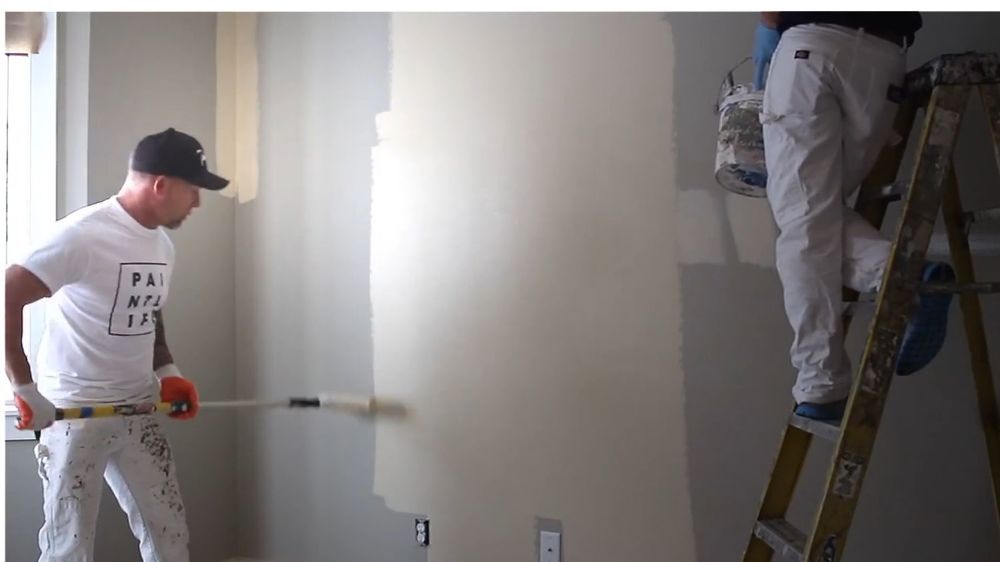
I want to click on walls, so click(324, 172), click(144, 83).